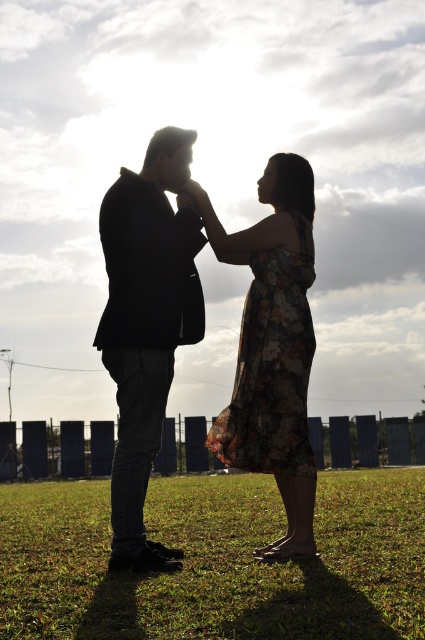
Does green grass at center have a greater width compared to floral-patterned fabric dress at center?

Yes.

Does green grass at center appear under floral-patterned fabric dress at center?

Indeed, green grass at center is positioned under floral-patterned fabric dress at center.

Between point (102, 486) and point (240, 435), which one is positioned behind?

Point (102, 486)

What are the coordinates of `green grass at center` in the screenshot? It's located at (217, 561).

Find the location of `black matte suit at center`. black matte suit at center is located at coordinates (147, 324).

Identify the location of black matte suit at center. The height and width of the screenshot is (640, 425). (147, 324).

Find the location of `black matte suit at center`. black matte suit at center is located at coordinates (147, 324).

Who is shorter, green grass at center or black matte suit at center?

With less height is green grass at center.

Which is in front, point (418, 600) or point (119, 236)?

Point (418, 600) is in front.

Image resolution: width=425 pixels, height=640 pixels. Describe the element at coordinates (217, 561) in the screenshot. I see `green grass at center` at that location.

I want to click on green grass at center, so click(217, 561).